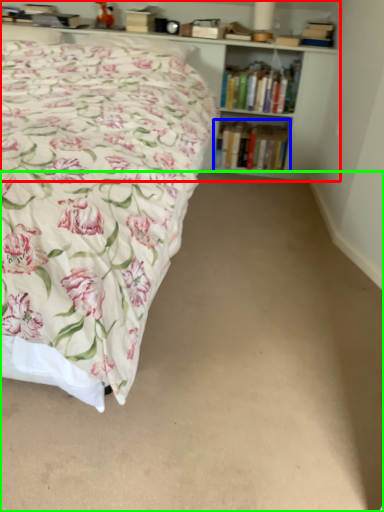
Question: Which object is positioned farthest from bookcase (highlighted by a red box)? Select from book (highlighted by a blue box) and plain (highlighted by a green box).

Choices:
 (A) book
 (B) plain

Answer: (B)